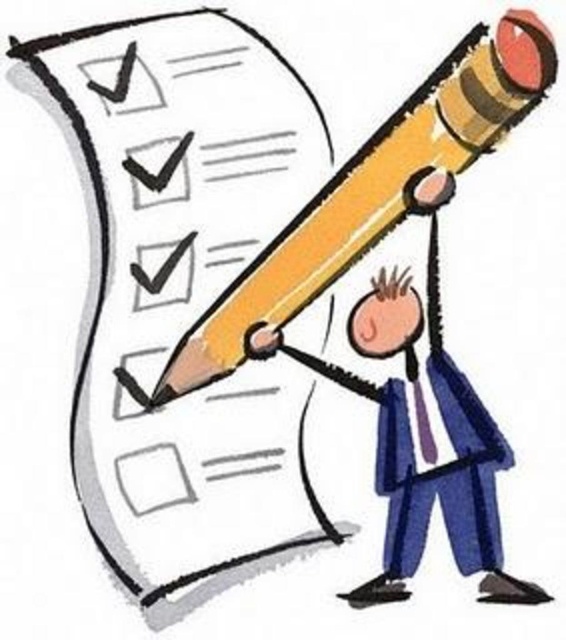
You are an observer looking at the image. You notice the yellow matte pencil at upper center and the blue fabric business suit at lower right. Which object is positioned higher in the image?

The yellow matte pencil at upper center is positioned higher than the blue fabric business suit at lower right.

You are an architect reviewing a blueprint. You notice two points marked on the drawing at coordinates point (294, 301) and point (395, 461). Which point is closer to the viewer?

Point (294, 301) is closer to the viewer than point (395, 461).

You are an artist trying to draw the scene described. When drawing the yellow matte pencil at upper center and the pink matte head at center, should you make the pencil wider than the head?

The yellow matte pencil at upper center might be wider than pink matte head at center according to the description, so you should draw the pencil wider than the head.